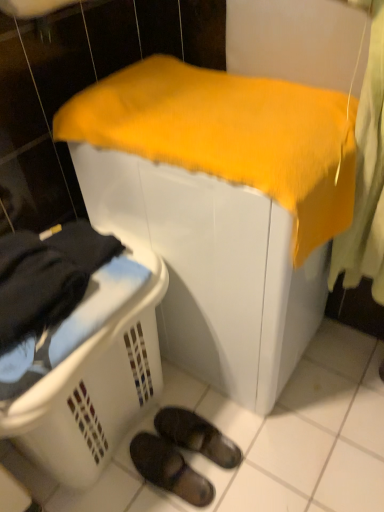
Question: From a real-world perspective, is black rubber slippers at lower center, the second footwear from the top, physically located above or below white plastic laundry basket at lower left?

Choices:
 (A) above
 (B) below

Answer: (B)

Question: In terms of width, does black rubber slippers at lower center, the first footwear when ordered from bottom to top, look wider or thinner when compared to white plastic laundry basket at lower left?

Choices:
 (A) thin
 (B) wide

Answer: (A)

Question: Considering the real-world distances, which object is closest to the yellow fabric-covered object at center?

Choices:
 (A) black rubber slippers at lower center, the second footwear from the top
 (B) black suede slippers at lower center, which is the second footwear from bottom to top
 (C) white plastic laundry basket at lower left

Answer: (C)

Question: Estimate the real-world distances between objects in this image. Which object is farther from the black suede slippers at lower center, which is counted as the first footwear, starting from the top?

Choices:
 (A) yellow fabric-covered object at center
 (B) white plastic laundry basket at lower left
 (C) black rubber slippers at lower center, the first footwear when ordered from bottom to top

Answer: (A)